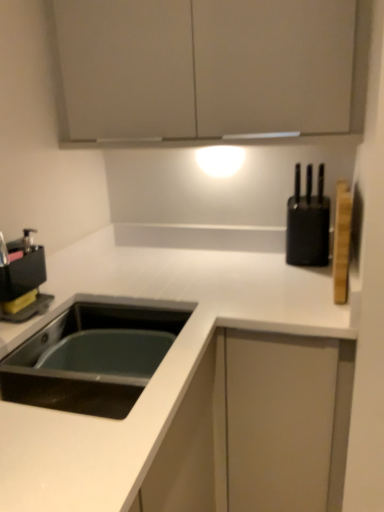
Measure the distance between point (311, 100) and camera.

Point (311, 100) is 4.02 feet from camera.

What do you see at coordinates (208, 68) in the screenshot? This screenshot has height=512, width=384. I see `matte white cabinet at upper center` at bounding box center [208, 68].

The height and width of the screenshot is (512, 384). What do you see at coordinates (93, 355) in the screenshot?
I see `black matte sink at lower left` at bounding box center [93, 355].

What are the coordinates of `matte white cabinet at upper center` in the screenshot? It's located at [x=208, y=68].

How many degrees apart are the facing directions of white matte countertop at lower left and black matte knife block at right?

They differ by 0.12 degrees in their facing directions.

Is white matte countertop at lower left looking in the opposite direction of black matte knife block at right?

No, white matte countertop at lower left is not facing the opposite direction of black matte knife block at right.

Which point is more forward, [229,259] or [303,258]?

The point [303,258] is in front.

Locate an element on the screen. The image size is (384, 512). appliance lying behind the white matte countertop at lower left is located at coordinates (308, 223).

Does black plastic coffee machine at left contain black matte knife block at right?

No, black matte knife block at right is not inside black plastic coffee machine at left.

Can you confirm if black plastic coffee machine at left is smaller than black matte knife block at right?

Correct, black plastic coffee machine at left occupies less space than black matte knife block at right.

Which object is thinner, black plastic coffee machine at left or black matte knife block at right?

With smaller width is black plastic coffee machine at left.

Does point (37, 259) come farther from viewer compared to point (299, 179)?

No, it is in front of (299, 179).

Is black matte sink at lower left not near white matte countertop at lower left?

No, black matte sink at lower left is in close proximity to white matte countertop at lower left.

From a real-world perspective, is black matte sink at lower left positioned under white matte countertop at lower left based on gravity?

No.

Is black matte sink at lower left spatially inside white matte countertop at lower left, or outside of it?

black matte sink at lower left is located beyond the bounds of white matte countertop at lower left.

Based on their positions, is black matte sink at lower left located to the left or right of white matte countertop at lower left?

Clearly, black matte sink at lower left is on the left of white matte countertop at lower left in the image.

From a real-world perspective, is matte white cabinet at upper center located beneath white matte countertop at lower left?

No, from a real-world perspective, matte white cabinet at upper center is not under white matte countertop at lower left.

Considering the positions of objects matte white cabinet at upper center and white matte countertop at lower left in the image provided, who is behind, matte white cabinet at upper center or white matte countertop at lower left?

Positioned behind is matte white cabinet at upper center.

Is matte white cabinet at upper center wider than white matte countertop at lower left?

Incorrect, the width of matte white cabinet at upper center does not surpass that of white matte countertop at lower left.

Is white matte countertop at lower left to the right of black plastic coffee machine at left from the viewer's perspective?

Yes.

Is white matte countertop at lower left far away from black plastic coffee machine at left?

Actually, white matte countertop at lower left and black plastic coffee machine at left are a little close together.

Would you say white matte countertop at lower left contains black plastic coffee machine at left?

No, black plastic coffee machine at left is not inside white matte countertop at lower left.

Which of these two, white matte countertop at lower left or black plastic coffee machine at left, is wider?

With larger width is white matte countertop at lower left.

From a real-world perspective, who is located higher, black plastic coffee machine at left or black matte sink at lower left?

black plastic coffee machine at left is physically above.

Looking at the image, does black plastic coffee machine at left seem bigger or smaller compared to black matte sink at lower left?

Considering their sizes, black plastic coffee machine at left takes up less space than black matte sink at lower left.

In the scene shown: Considering the relative sizes of black plastic coffee machine at left and black matte sink at lower left in the image provided, is black plastic coffee machine at left taller than black matte sink at lower left?

Correct, black plastic coffee machine at left is much taller as black matte sink at lower left.

Could you tell me if black plastic coffee machine at left is turned towards black matte sink at lower left?

No.

Which point is more distant from viewer, (36, 251) or (322, 456)?

Positioned behind is point (36, 251).

Which object is positioned more to the right, black plastic coffee machine at left or white matte countertop at lower left?

Positioned to the right is white matte countertop at lower left.

Is black plastic coffee machine at left smaller than white matte countertop at lower left?

Correct, black plastic coffee machine at left occupies less space than white matte countertop at lower left.

How distant is black plastic coffee machine at left from white matte countertop at lower left?

black plastic coffee machine at left is 16.87 inches from white matte countertop at lower left.

You are a GUI agent. You are given a task and a screenshot of the screen. Output one action in this format:
    pyautogui.click(x=<x>, y=<y>)
    Task: Click on the countertop located in front of the black matte knife block at right
    
    Given the screenshot: What is the action you would take?
    pyautogui.click(x=182, y=387)

The image size is (384, 512). Find the location of `appliance that is behind the black plastic coffee machine at left`. appliance that is behind the black plastic coffee machine at left is located at coordinates (308, 223).

From the image, which object appears to be farther from black matte knife block at right, black plastic coffee machine at left or black matte sink at lower left?

black plastic coffee machine at left is positioned further to the anchor black matte knife block at right.

From the image, which object appears to be farther from white matte countertop at lower left, matte white cabinet at upper center or black plastic coffee machine at left?

matte white cabinet at upper center.

Which object lies further to the anchor point black matte sink at lower left, black matte knife block at right or matte white cabinet at upper center?

matte white cabinet at upper center.

Looking at this image, based on their spatial positions, is matte white cabinet at upper center or black matte sink at lower left closer to black matte knife block at right?

Among the two, matte white cabinet at upper center is located nearer to black matte knife block at right.

Which object lies further to the anchor point black plastic coffee machine at left, matte white cabinet at upper center or black matte sink at lower left?

Based on the image, matte white cabinet at upper center appears to be further to black plastic coffee machine at left.

Consider the image. From the image, which object appears to be nearer to black matte knife block at right, black plastic coffee machine at left or white matte countertop at lower left?

white matte countertop at lower left.

Based on their spatial positions, is matte white cabinet at upper center or black matte knife block at right closer to black plastic coffee machine at left?

matte white cabinet at upper center.

Based on their spatial positions, is black matte knife block at right or matte white cabinet at upper center further from black plastic coffee machine at left?

black matte knife block at right lies further to black plastic coffee machine at left than the other object.

Find the location of a particular element. Image resolution: width=384 pixels, height=512 pixels. coffee machine that lies between matte white cabinet at upper center and black matte sink at lower left from top to bottom is located at coordinates (22, 279).

Image resolution: width=384 pixels, height=512 pixels. In order to click on appliance between matte white cabinet at upper center and white matte countertop at lower left in the vertical direction in this screenshot , I will do `click(308, 223)`.

Where is `countertop situated between black matte sink at lower left and black matte knife block at right from left to right`? countertop situated between black matte sink at lower left and black matte knife block at right from left to right is located at coordinates (182, 387).

Find the location of a particular element. The height and width of the screenshot is (512, 384). sink between matte white cabinet at upper center and white matte countertop at lower left in the up-down direction is located at coordinates (93, 355).